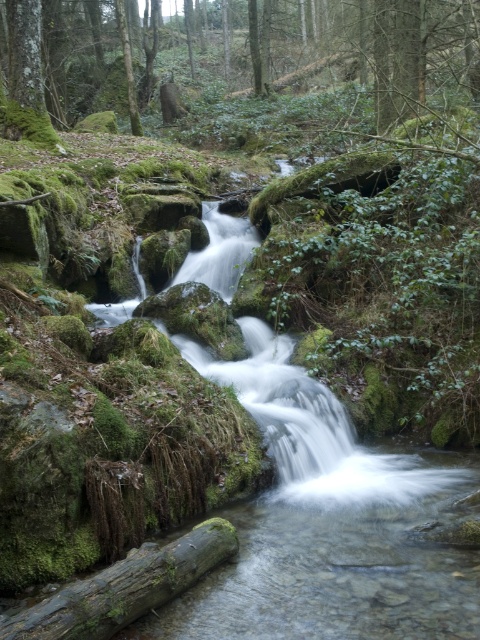
You are a hiker trying to cross the stream. You see the green mossy tree at upper center and the green mossy log at lower center. Which object is bigger and can provide a more stable footing?

The green mossy tree at upper center is larger than the green mossy log at lower center, so it can provide a more stable footing.

Based on the scene description, where is the green mossy tree at upper center located in terms of its 2D coordinates?

The green mossy tree at upper center is located at the 2D coordinates of point [316,48].

You are standing at the edge of the stream in the forest scene. You notice a point marked at coordinates (316, 48). What object is located at this point?

The point at coordinates (316, 48) corresponds to the green mossy tree at upper center.